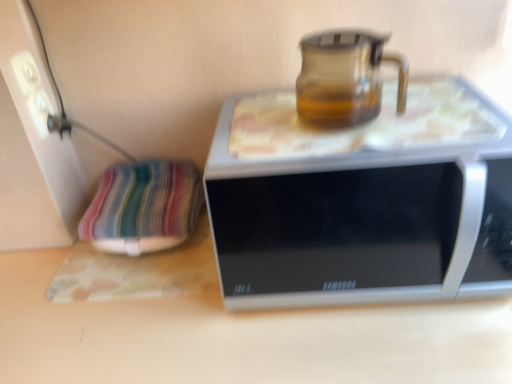
This screenshot has height=384, width=512. I want to click on free space to the back side of transparent glass jug at upper center, so click(335, 115).